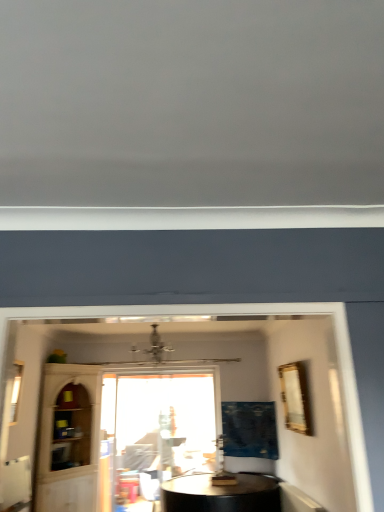
Question: Considering their positions, is clear glass window at left, which is the 1th window from front to back, located in front of or behind transparent glass cabinet at lower left?

Choices:
 (A) behind
 (B) front

Answer: (B)

Question: From a real-world perspective, is clear glass window at left, the 1th window in the top-to-bottom sequence, above or below transparent glass cabinet at lower left?

Choices:
 (A) below
 (B) above

Answer: (B)

Question: Which of these objects is positioned closest to the gold metallic picture frame at upper right?

Choices:
 (A) clear glass window at left, the 2th window positioned from the back
 (B) transparent glass cabinet at lower left
 (C) transparent glass window at center, placed as the first window when sorted from bottom to top
 (D) blue fabric curtain at center

Answer: (D)

Question: Estimate the real-world distances between objects in this image. Which object is closer to the blue fabric curtain at center?

Choices:
 (A) clear glass window at left, the 2th window viewed from the right
 (B) gold metallic picture frame at upper right
 (C) transparent glass window at center, acting as the 1th window starting from the back
 (D) transparent glass cabinet at lower left

Answer: (C)